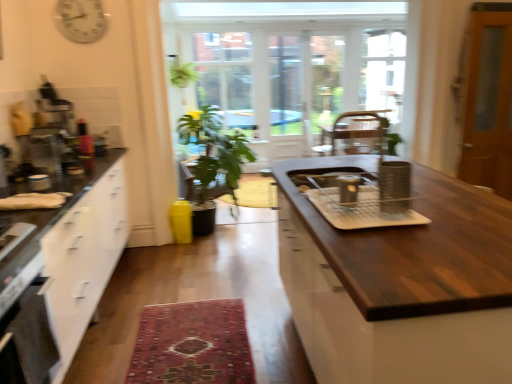
Question: Looking at their shapes, would you say carpeted rug at center is wider or thinner than white glossy clock at upper left?

Choices:
 (A) thin
 (B) wide

Answer: (B)

Question: Is carpeted rug at center taller or shorter than white glossy clock at upper left?

Choices:
 (A) short
 (B) tall

Answer: (A)

Question: Which is farther from the white glossy clock at upper left?

Choices:
 (A) dark wood countertop at center
 (B) black matte oven at lower left
 (C) carpeted rug at center
 (D) metallic silver coffee machine at left, placed as the fifth appliance when sorted from right to left
 (E) green matte plant at center

Answer: (A)

Question: Which object is positioned closest to the green matte plant at center?

Choices:
 (A) metallic silver coffee machine at left, placed as the first appliance when sorted from left to right
 (B) metallic silver toaster at left, which ranks as the 4th appliance in right-to-left order
 (C) wooden screen door at right
 (D) carpeted rug at center
 (E) metallic silver canister at center, which is the 3th appliance in left-to-right order

Answer: (A)